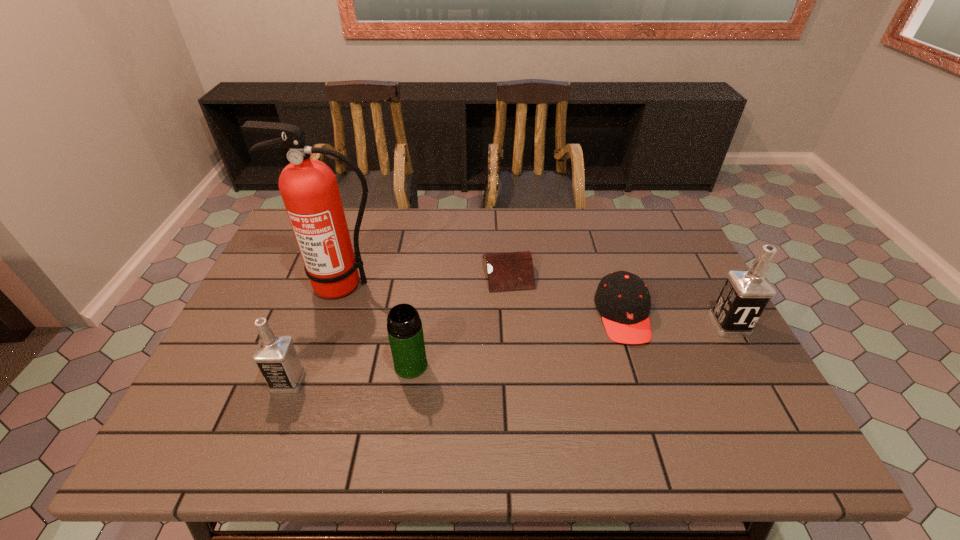
Identify the location of the nearer vodka. (275, 355).

I want to click on the left vodka, so click(275, 355).

Image resolution: width=960 pixels, height=540 pixels. Find the location of `the fifth shortest object`. the fifth shortest object is located at coordinates (746, 293).

The height and width of the screenshot is (540, 960). What are the coordinates of `the farther vodka` in the screenshot? It's located at (746, 293).

Image resolution: width=960 pixels, height=540 pixels. I want to click on the tallest object, so click(x=309, y=189).

Locate an element on the screen. the second shortest object is located at coordinates (622, 298).

In order to click on the fifth object from left to right in this screenshot , I will do `click(622, 298)`.

Identify the location of the shortest object. (508, 271).

Locate an element on the screen. The width and height of the screenshot is (960, 540). the third object from right to left is located at coordinates (508, 271).

Where is `the third object from left to right`? This screenshot has height=540, width=960. the third object from left to right is located at coordinates 404,326.